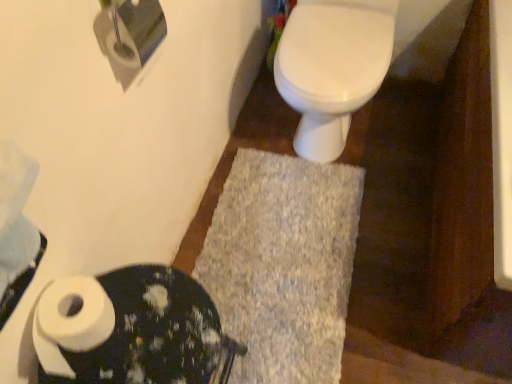
The width and height of the screenshot is (512, 384). I want to click on free space to the right of gray shaggy bath mat at center, so click(x=396, y=231).